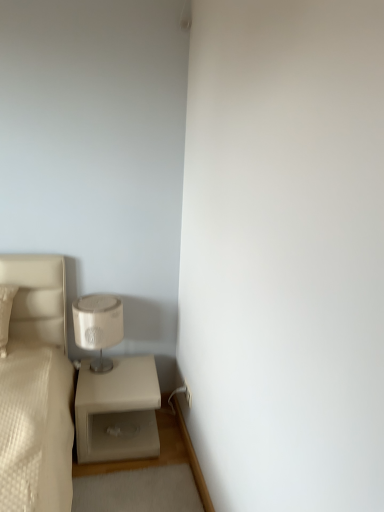
Question: Is matte beige lampshade at lower left taller or shorter than beige matte nightstand at lower left?

Choices:
 (A) short
 (B) tall

Answer: (B)

Question: From the image's perspective, is matte beige lampshade at lower left above or below beige matte nightstand at lower left?

Choices:
 (A) below
 (B) above

Answer: (B)

Question: Considering the positions of matte beige lampshade at lower left and beige matte nightstand at lower left in the image, is matte beige lampshade at lower left wider or thinner than beige matte nightstand at lower left?

Choices:
 (A) thin
 (B) wide

Answer: (A)

Question: From the image's perspective, is beige matte nightstand at lower left located above or below matte beige lampshade at lower left?

Choices:
 (A) above
 (B) below

Answer: (B)

Question: From a real-world perspective, is beige matte nightstand at lower left physically located above or below matte beige lampshade at lower left?

Choices:
 (A) below
 (B) above

Answer: (A)

Question: Is beige matte nightstand at lower left to the left or to the right of matte beige lampshade at lower left in the image?

Choices:
 (A) left
 (B) right

Answer: (B)

Question: Do you think beige matte nightstand at lower left is within matte beige lampshade at lower left, or outside of it?

Choices:
 (A) inside
 (B) outside

Answer: (B)